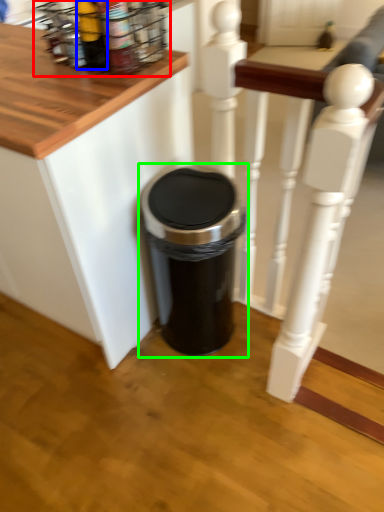
Question: Estimate the real-world distances between objects in this image. Which object is farther from spice rack (highlighted by a red box), bottle (highlighted by a blue box) or waste container (highlighted by a green box)?

Choices:
 (A) bottle
 (B) waste container

Answer: (B)